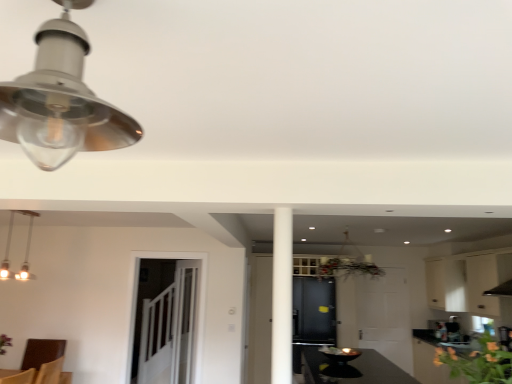
Question: From a real-world perspective, does clear glass door at center stand above white matte cabinet at upper right, which appears as the second cabinetry when viewed from the left?

Choices:
 (A) yes
 (B) no

Answer: (B)

Question: Can you confirm if clear glass door at center is shorter than white matte cabinet at upper right, the first cabinetry when ordered from right to left?

Choices:
 (A) yes
 (B) no

Answer: (B)

Question: Is clear glass door at center at the left side of white matte cabinet at upper right, which appears as the second cabinetry when viewed from the left?

Choices:
 (A) yes
 (B) no

Answer: (A)

Question: Can you confirm if clear glass door at center is thinner than white matte cabinet at upper right, the first cabinetry when ordered from right to left?

Choices:
 (A) yes
 (B) no

Answer: (A)

Question: From the image's perspective, is clear glass door at center below white matte cabinet at upper right, the first cabinetry when ordered from right to left?

Choices:
 (A) no
 (B) yes

Answer: (B)

Question: In the image, is clear glass door at center on the left side or the right side of green leafy plant at lower right?

Choices:
 (A) right
 (B) left

Answer: (B)

Question: Considering the positions of point (189, 332) and point (485, 365), is point (189, 332) closer or farther from the camera than point (485, 365)?

Choices:
 (A) closer
 (B) farther

Answer: (B)

Question: Choose the correct answer: Is clear glass door at center inside green leafy plant at lower right or outside it?

Choices:
 (A) inside
 (B) outside

Answer: (B)

Question: Looking at their shapes, would you say clear glass door at center is wider or thinner than green leafy plant at lower right?

Choices:
 (A) thin
 (B) wide

Answer: (A)

Question: In the image, is matte black cabinet at center, the second cabinetry positioned from the right, positioned in front of or behind white glossy pendant light at upper left, which is the first lamp in left-to-right order?

Choices:
 (A) behind
 (B) front

Answer: (A)

Question: From a real-world perspective, is matte black cabinet at center, the second cabinetry positioned from the right, physically located above or below white glossy pendant light at upper left, which is the 1th lamp from bottom to top?

Choices:
 (A) below
 (B) above

Answer: (A)

Question: Visually, is matte black cabinet at center, the second cabinetry positioned from the right, positioned to the left or to the right of white glossy pendant light at upper left, placed as the second lamp when sorted from top to bottom?

Choices:
 (A) right
 (B) left

Answer: (A)

Question: Looking at the image, does matte black cabinet at center, which is counted as the 1th cabinetry, starting from the left, seem bigger or smaller compared to white glossy pendant light at upper left, the 1th lamp when ordered from back to front?

Choices:
 (A) big
 (B) small

Answer: (A)

Question: Does point (485, 261) appear closer or farther from the camera than point (489, 354)?

Choices:
 (A) closer
 (B) farther

Answer: (B)

Question: Is white matte cabinet at upper right, which appears as the second cabinetry when viewed from the left, to the left or to the right of green leafy plant at lower right in the image?

Choices:
 (A) left
 (B) right

Answer: (B)